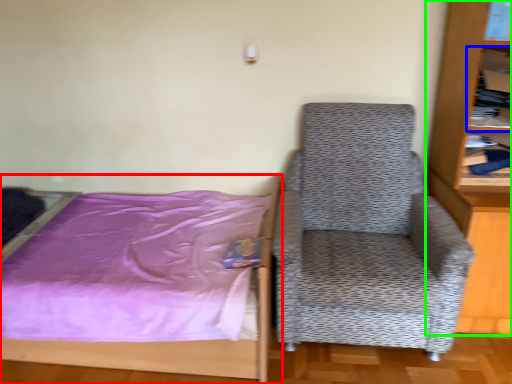
Question: Which object is the closest to the bed (highlighted by a red box)? Choose among these: shelf (highlighted by a blue box) or bookcase (highlighted by a green box).

Choices:
 (A) shelf
 (B) bookcase

Answer: (B)